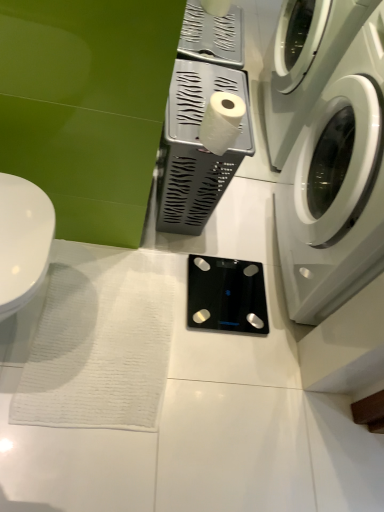
Question: Considering their positions, is white plastic tissue holder at center, placed as the first appliance when sorted from top to bottom, located in front of or behind white glossy washing machine at right?

Choices:
 (A) front
 (B) behind

Answer: (B)

Question: From the image's perspective, is white plastic tissue holder at center, placed as the first appliance when sorted from top to bottom, positioned above or below white glossy washing machine at right?

Choices:
 (A) above
 (B) below

Answer: (A)

Question: Which object is the farthest from the white glossy toilet at left?

Choices:
 (A) white matte toilet paper at center
 (B) black glass scale at center, acting as the 2th appliance starting from the top
 (C) white glossy washing machine at right
 (D) white plastic tissue holder at center, which appears as the 2th appliance when ordered from the bottom

Answer: (C)

Question: Based on their relative distances, which object is nearer to the black glass scale at center, which is the first appliance in bottom-to-top order?

Choices:
 (A) white glossy toilet at left
 (B) white matte toilet paper at center
 (C) white glossy washing machine at right
 (D) white plastic tissue holder at center, which appears as the 2th appliance when ordered from the bottom

Answer: (D)